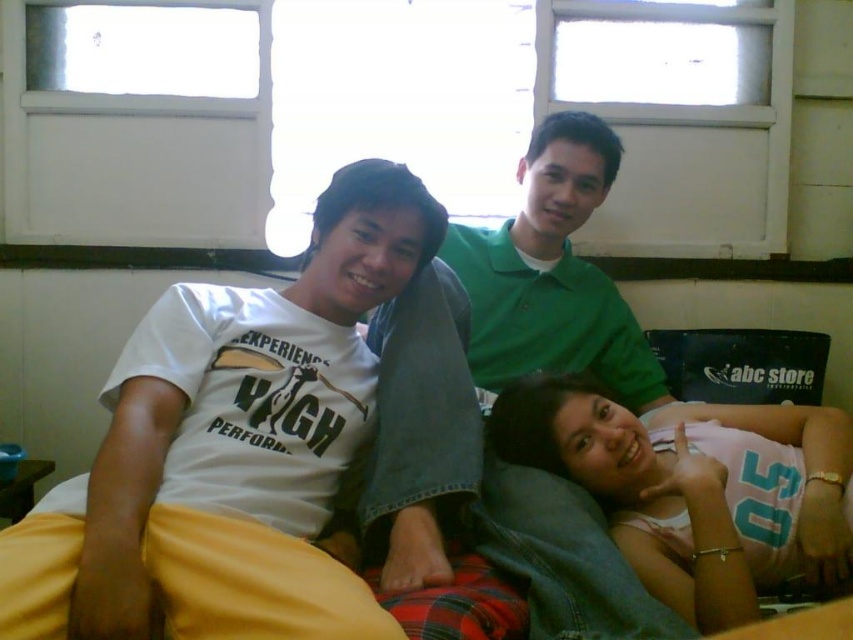
Which is below, white matte t-shirt at center or pink fabric at center?

pink fabric at center

Who is taller, white matte t-shirt at center or pink fabric at center?

With more height is white matte t-shirt at center.

The image size is (853, 640). What do you see at coordinates (229, 449) in the screenshot? I see `white matte t-shirt at center` at bounding box center [229, 449].

The width and height of the screenshot is (853, 640). I want to click on white matte t-shirt at center, so click(x=229, y=449).